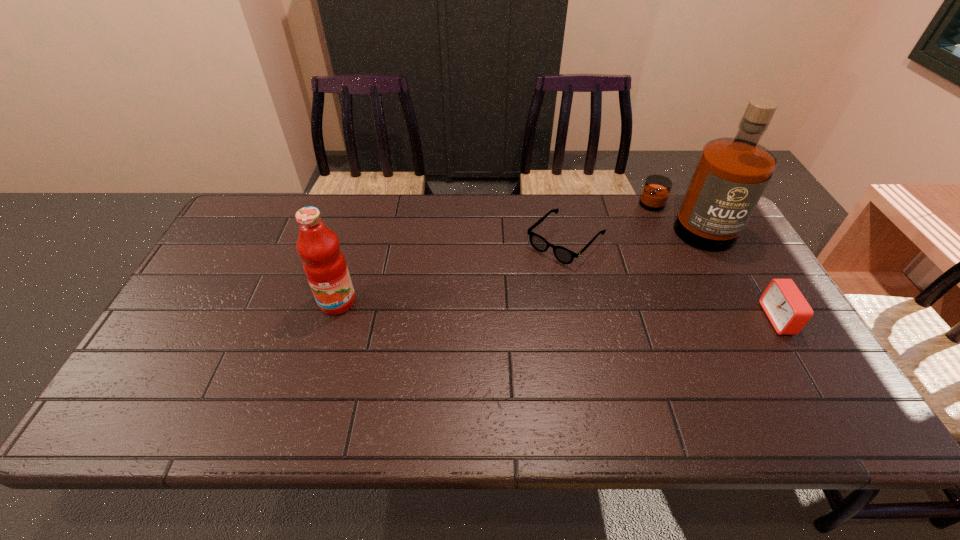
Where is `vacant spot on the desktop that is between the leftmost object and the second shortest object and is positioned on the arms of the shortest object`? vacant spot on the desktop that is between the leftmost object and the second shortest object and is positioned on the arms of the shortest object is located at coordinates (498, 308).

Identify the location of vacant spot on the desktop that is between the fruit juice and the second shortest object and is positioned on the front label of the tallest object. (602, 312).